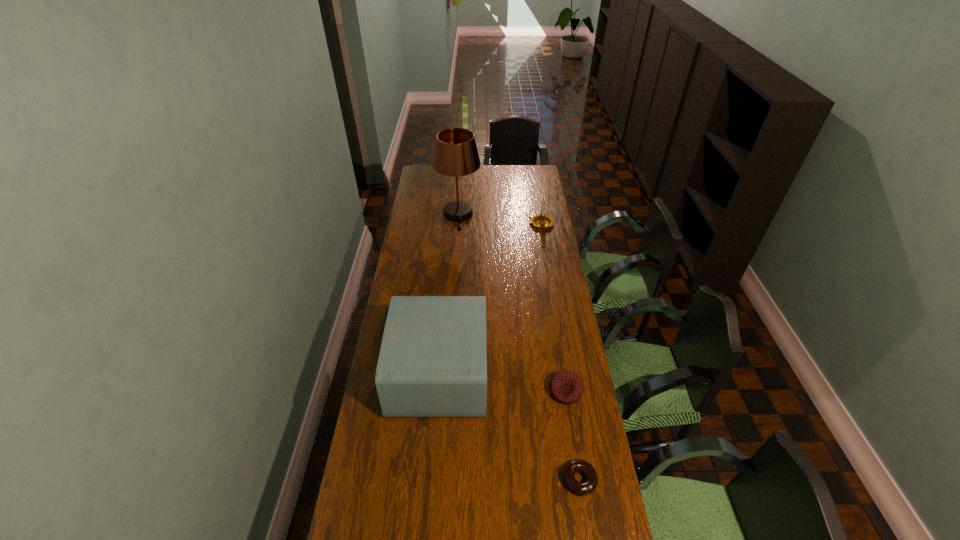
Where is `free space that is in between the tallest object and the fourth shortest object`? The height and width of the screenshot is (540, 960). free space that is in between the tallest object and the fourth shortest object is located at coordinates point(449,293).

Where is `blank region between the lampshade and the fourth shortest object`? The height and width of the screenshot is (540, 960). blank region between the lampshade and the fourth shortest object is located at coordinates (449, 293).

I want to click on vacant area that lies between the nearest object and the beanbag, so click(572, 436).

Identify the location of unoccupied position between the second shortest object and the shortest object. (572, 436).

Locate an element on the screen. Image resolution: width=960 pixels, height=540 pixels. free space that is in between the candle holder and the beanbag is located at coordinates (553, 307).

Find the location of a particular element. This screenshot has width=960, height=540. free spot between the beanbag and the nearest object is located at coordinates (572, 436).

You are a GUI agent. You are given a task and a screenshot of the screen. Output one action in this format:
    pyautogui.click(x=<x>, y=<y>)
    Task: Click on the unoccupied area between the radio receiver and the second shortest object
    
    Given the screenshot: What is the action you would take?
    pyautogui.click(x=502, y=382)

Identify the location of vacant area that lies between the second shortest object and the nearest object. Image resolution: width=960 pixels, height=540 pixels. (572, 436).

What are the coordinates of `free area in between the candle holder and the shortest object` in the screenshot? It's located at (561, 352).

Select which object appears as the fourth closest to the candle holder. Please provide its 2D coordinates. Your answer should be formatted as a tuple, i.e. [(x, y)], where the tuple contains the x and y coordinates of a point satisfying the conditions above.

[(584, 488)]